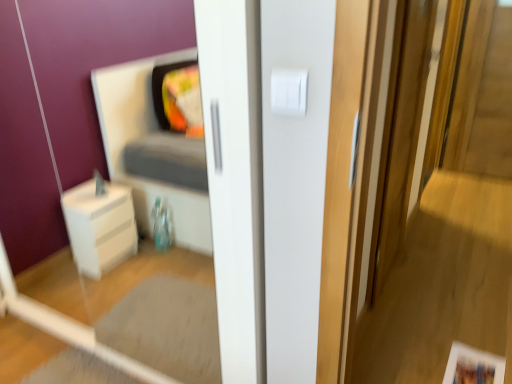
Question: Based on their positions, is white plastic light switch at upper center located to the left or right of wooden screen door at right?

Choices:
 (A) right
 (B) left

Answer: (B)

Question: In terms of height, does white plastic light switch at upper center look taller or shorter compared to wooden screen door at right?

Choices:
 (A) short
 (B) tall

Answer: (A)

Question: From a real-world perspective, is white plastic light switch at upper center physically located above or below wooden screen door at right?

Choices:
 (A) below
 (B) above

Answer: (B)

Question: Considering the positions of wooden screen door at right and white plastic light switch at upper center in the image, is wooden screen door at right taller or shorter than white plastic light switch at upper center?

Choices:
 (A) short
 (B) tall

Answer: (B)

Question: Is wooden screen door at right spatially inside white plastic light switch at upper center, or outside of it?

Choices:
 (A) outside
 (B) inside

Answer: (A)

Question: From the image's perspective, is wooden screen door at right positioned above or below white plastic light switch at upper center?

Choices:
 (A) above
 (B) below

Answer: (B)

Question: From a real-world perspective, is wooden screen door at right physically located above or below white plastic light switch at upper center?

Choices:
 (A) below
 (B) above

Answer: (A)